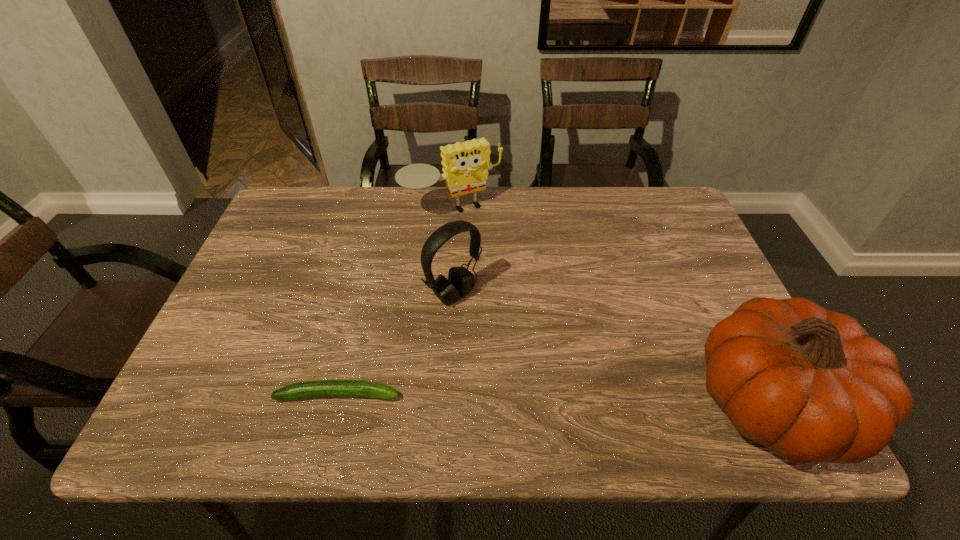
Identify the location of the shortest object. This screenshot has height=540, width=960. (326, 388).

Where is `pumpkin`? pumpkin is located at coordinates (810, 384).

The image size is (960, 540). In order to click on sponge in this screenshot , I will do `click(465, 165)`.

Find the location of a particular element. This screenshot has height=540, width=960. headset is located at coordinates (460, 282).

Where is `vacant region located 0.250m on the front-facing side of the zucchini`? The height and width of the screenshot is (540, 960). vacant region located 0.250m on the front-facing side of the zucchini is located at coordinates (522, 395).

At what (x,y) coordinates should I click in order to perform the action: click on free region located 0.250m on the front-facing side of the farthest object. Please return your answer as a coordinate pair (x, y). This screenshot has width=960, height=540. Looking at the image, I should click on (509, 287).

Image resolution: width=960 pixels, height=540 pixels. What are the coordinates of `free point located on the front-facing side of the farthest object` in the screenshot? It's located at (505, 281).

You are a GUI agent. You are given a task and a screenshot of the screen. Output one action in this format:
    pyautogui.click(x=<x>, y=<y>)
    Task: Click on the vacant area located 0.360m on the front-facing side of the farthest object
    The width and height of the screenshot is (960, 540).
    Given the screenshot: What is the action you would take?
    pyautogui.click(x=528, y=318)

At what (x,y) coordinates should I click in order to perform the action: click on vacant space situated 0.080m on the front-facing side of the second farthest object. Please return your answer as a coordinate pair (x, y). The height and width of the screenshot is (540, 960). Looking at the image, I should click on (494, 329).

This screenshot has width=960, height=540. In order to click on free spot located on the front-facing side of the second farthest object in this screenshot , I will do `click(500, 334)`.